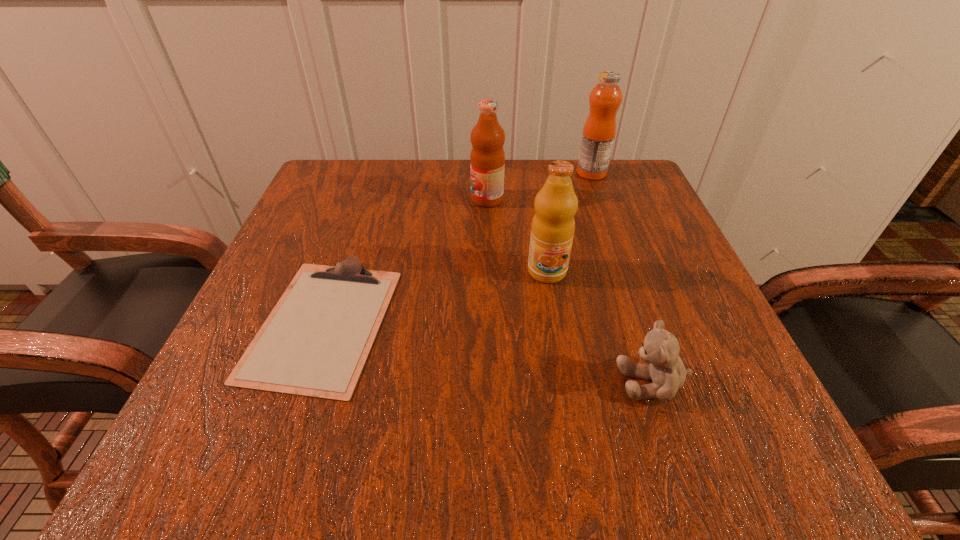
This screenshot has width=960, height=540. In order to click on vacant area between the fourth tallest object and the second fruit juice from left to right in this screenshot , I will do `click(600, 327)`.

Locate an element on the screen. The height and width of the screenshot is (540, 960). free point between the teddy bear and the farthest fruit juice is located at coordinates (622, 278).

Find the location of a particular element. This screenshot has height=540, width=960. free space that is in between the leftmost fruit juice and the leftmost object is located at coordinates (405, 261).

Identify the location of vacant point located between the fourth nearest object and the teddy bear. (570, 291).

Identify the location of vacant area that lies between the third object from right to left and the fourth object from right to left. (517, 235).

Image resolution: width=960 pixels, height=540 pixels. Identify the location of the closest object to the teddy bear. (553, 225).

Locate which object ranks fourth in proximity to the fourth tallest object. Please provide its 2D coordinates. Your answer should be formatted as a tuple, i.e. [(x, y)], where the tuple contains the x and y coordinates of a point satisfying the conditions above.

[(599, 130)]

The image size is (960, 540). I want to click on fruit juice object that ranks as the second closest to the farthest object, so click(x=553, y=225).

Locate which fruit juice ranks second in proximity to the farthest object. Please provide its 2D coordinates. Your answer should be formatted as a tuple, i.e. [(x, y)], where the tuple contains the x and y coordinates of a point satisfying the conditions above.

[(553, 225)]